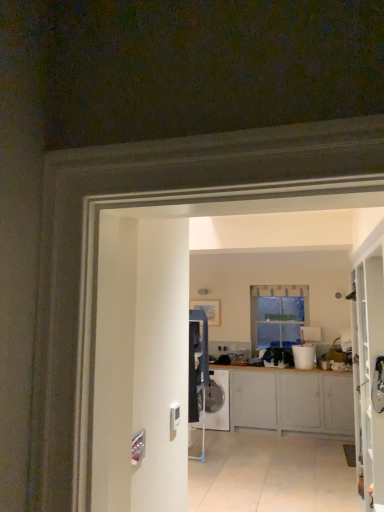
What do you see at coordinates (292, 401) in the screenshot? The image size is (384, 512). I see `matte gray cabinets at center` at bounding box center [292, 401].

This screenshot has height=512, width=384. What do you see at coordinates (277, 315) in the screenshot?
I see `clear glass window at center` at bounding box center [277, 315].

The width and height of the screenshot is (384, 512). Find the location of `white glossy washing machine at center`. white glossy washing machine at center is located at coordinates (222, 406).

At what (x,y) coordinates should I click in order to perform the action: click on matte gray cabinets at center. Please return your answer as a coordinate pair (x, y). The image size is (384, 512). Looking at the image, I should click on (292, 401).

From the image's perspective, between clear glass window at center and white glossy washing machine at center, who is located below?

white glossy washing machine at center is shown below in the image.

Does clear glass window at center come behind white glossy washing machine at center?

That is True.

Is clear glass window at center wider or thinner than white glossy washing machine at center?

clear glass window at center is thinner than white glossy washing machine at center.

Which is more to the left, clear glass window at center or white glossy washing machine at center?

From the viewer's perspective, white glossy washing machine at center appears more on the left side.

From the image's perspective, is white glossy bucket at center on top of matte gray cabinets at center?

Correct, white glossy bucket at center appears higher than matte gray cabinets at center in the image.

Can you see white glossy bucket at center touching matte gray cabinets at center?

They are not placed beside each other.

Is white glossy bucket at center closer to the viewer compared to matte gray cabinets at center?

No, the depth of white glossy bucket at center is greater than that of matte gray cabinets at center.

From a real-world perspective, is white glossy bucket at center positioned over matte gray cabinets at center based on gravity?

Yes, from a real-world perspective, white glossy bucket at center is above matte gray cabinets at center.

Which is in front, clear glass window at center or matte gray cabinets at center?

matte gray cabinets at center is more forward.

How different are the orientations of clear glass window at center and matte gray cabinets at center in degrees?

The angle between the facing direction of clear glass window at center and the facing direction of matte gray cabinets at center is 0.31 degrees.

I want to click on window behind the matte gray cabinets at center, so click(277, 315).

Does point (297, 297) appear closer or farther from the camera than point (321, 391)?

Point (297, 297) appears to be farther away from the viewer than point (321, 391).

In the scene shown: From a real-world perspective, relative to white glossy washing machine at center, is matte gray cabinets at center vertically above or below?

matte gray cabinets at center is situated higher than white glossy washing machine at center in the real world.

Does matte gray cabinets at center have a larger size compared to white glossy washing machine at center?

Indeed, matte gray cabinets at center has a larger size compared to white glossy washing machine at center.

Which object is more forward, matte gray cabinets at center or white glossy washing machine at center?

Positioned in front is matte gray cabinets at center.

The width and height of the screenshot is (384, 512). Identify the location of washing machine that appears below the matte gray cabinets at center (from the image's perspective). (222, 406).

Is matte gray cabinets at center facing towards white glossy bucket at center?

No, matte gray cabinets at center does not turn towards white glossy bucket at center.

Considering the positions of point (302, 406) and point (299, 351), is point (302, 406) closer or farther from the camera than point (299, 351)?

Point (302, 406) is closer to the camera than point (299, 351).

From the image's perspective, between matte gray cabinets at center and white glossy bucket at center, which one is located above?

white glossy bucket at center is shown above in the image.

In the image, is matte gray cabinets at center on the left side or the right side of white glossy bucket at center?

In the image, matte gray cabinets at center appears on the left side of white glossy bucket at center.

Is white glossy washing machine at center with white glossy bucket at center?

white glossy washing machine at center and white glossy bucket at center are clearly separated.

From the image's perspective, between white glossy washing machine at center and white glossy bucket at center, who is located below?

From the image's view, white glossy washing machine at center is below.

Looking at this image, is white glossy washing machine at center positioned with its back to white glossy bucket at center?

No.

Looking at this image, between white glossy washing machine at center and white glossy bucket at center, which one is positioned in front?

white glossy bucket at center is more forward.

Consider the image. Measure the distance between clear glass window at center and white glossy bucket at center.

They are 20.97 inches apart.

Which object is further away from the camera taking this photo, clear glass window at center or white glossy bucket at center?

clear glass window at center is more distant.

From the image's perspective, is clear glass window at center located above or below white glossy bucket at center?

clear glass window at center is situated higher than white glossy bucket at center in the image.

From a real-world perspective, between clear glass window at center and white glossy bucket at center, who is vertically higher?

In real-world perspective, clear glass window at center is above.

The height and width of the screenshot is (512, 384). I want to click on window on the right side of white glossy washing machine at center, so click(277, 315).

You are a GUI agent. You are given a task and a screenshot of the screen. Output one action in this format:
    pyautogui.click(x=<x>, y=<y>)
    Task: Click on the appliance behind the matte gray cabinets at center
    
    Given the screenshot: What is the action you would take?
    pyautogui.click(x=304, y=356)

Which object lies nearer to the anchor point clear glass window at center, matte gray cabinets at center or white glossy washing machine at center?

matte gray cabinets at center is positioned closer to the anchor clear glass window at center.

Looking at this image, estimate the real-world distances between objects in this image. Which object is further from white glossy bucket at center, white glossy washing machine at center or clear glass window at center?

white glossy washing machine at center is positioned further to the anchor white glossy bucket at center.

When comparing their distances from white glossy washing machine at center, does white glossy bucket at center or matte gray cabinets at center seem further?

white glossy bucket at center is positioned further to the anchor white glossy washing machine at center.

Looking at the image, which one is located closer to clear glass window at center, matte gray cabinets at center or white glossy bucket at center?

white glossy bucket at center is closer to clear glass window at center.

Based on their spatial positions, is white glossy bucket at center or white glossy washing machine at center closer to matte gray cabinets at center?

white glossy bucket at center is positioned closer to the anchor matte gray cabinets at center.

Which object lies nearer to the anchor point clear glass window at center, white glossy washing machine at center or matte gray cabinets at center?

Among the two, matte gray cabinets at center is located nearer to clear glass window at center.

Looking at the image, which one is located further to white glossy washing machine at center, matte gray cabinets at center or white glossy bucket at center?

white glossy bucket at center is positioned further to the anchor white glossy washing machine at center.

Based on the photo, when comparing their distances from matte gray cabinets at center, does white glossy washing machine at center or clear glass window at center seem closer?

Based on the image, white glossy washing machine at center appears to be nearer to matte gray cabinets at center.

What are the coordinates of `cabinetry between white glossy washing machine at center and white glossy bucket at center` in the screenshot? It's located at pyautogui.click(x=292, y=401).

I want to click on window between white glossy washing machine at center and white glossy bucket at center in the horizontal direction, so click(x=277, y=315).

You are a GUI agent. You are given a task and a screenshot of the screen. Output one action in this format:
    pyautogui.click(x=<x>, y=<y>)
    Task: Click on the appliance between matte gray cabinets at center and clear glass window at center from front to back
    The image size is (384, 512).
    Given the screenshot: What is the action you would take?
    pyautogui.click(x=304, y=356)

At what (x,y) coordinates should I click in order to perform the action: click on cabinetry that lies between clear glass window at center and white glossy washing machine at center from top to bottom. Please return your answer as a coordinate pair (x, y). This screenshot has height=512, width=384. Looking at the image, I should click on (292, 401).